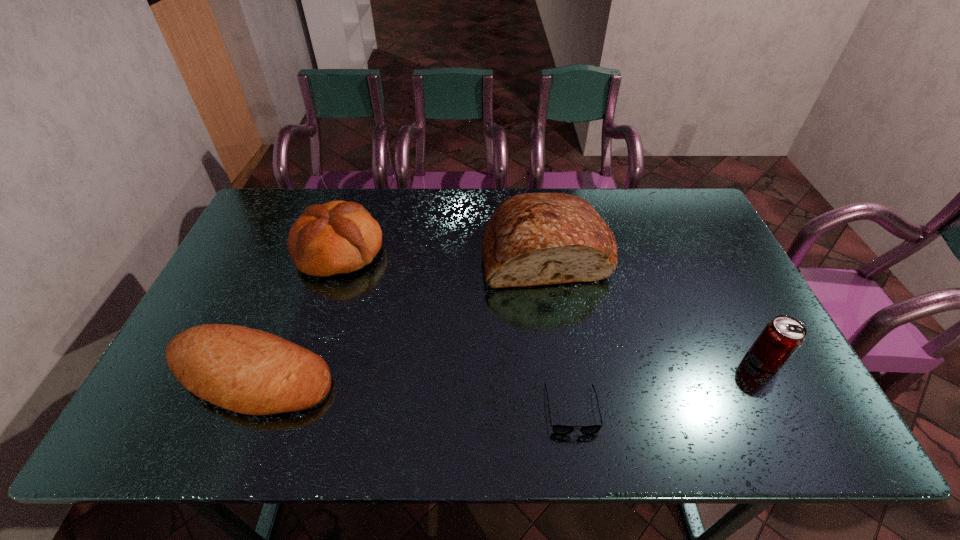
Find the location of a particular element. The height and width of the screenshot is (540, 960). vacant space positioned 0.260m on the right of the shortest bread is located at coordinates (444, 376).

Locate an element on the screen. The image size is (960, 540). bread that is at the near edge is located at coordinates (248, 371).

Image resolution: width=960 pixels, height=540 pixels. I want to click on spectacles that is at the near edge, so click(x=558, y=429).

What are the coordinates of `object that is at the left edge` in the screenshot? It's located at (248, 371).

I want to click on object that is at the right edge, so click(781, 338).

Image resolution: width=960 pixels, height=540 pixels. I want to click on object at the near left corner, so click(x=248, y=371).

Identify the location of vacant area at the far edge of the desktop. This screenshot has width=960, height=540. (432, 199).

Locate an element on the screen. This screenshot has height=540, width=960. vacant space at the near edge is located at coordinates (716, 410).

Where is `free region at the left edge of the desktop`? This screenshot has height=540, width=960. free region at the left edge of the desktop is located at coordinates [x=270, y=281].

In the image, there is a desktop. Where is `vacant space at the right edge`? The height and width of the screenshot is (540, 960). vacant space at the right edge is located at coordinates (735, 290).